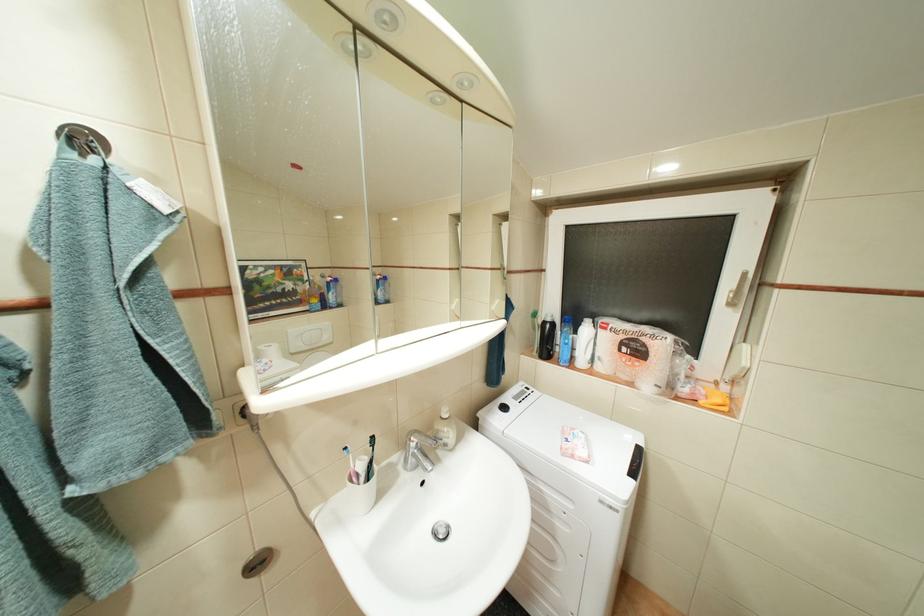
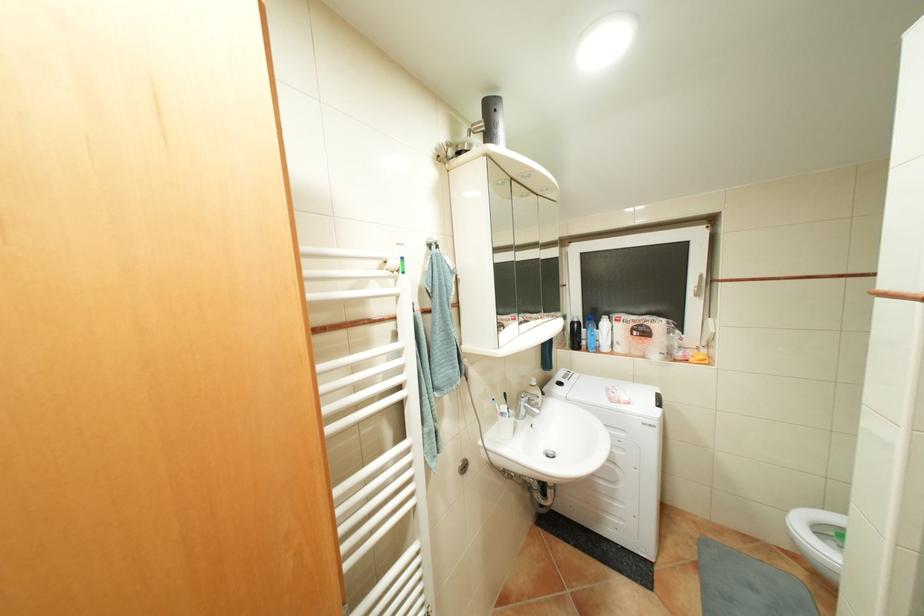
The images are taken continuously from a first-person perspective. In which direction are you moving?

The movement direction of the cameraman is left, backward.